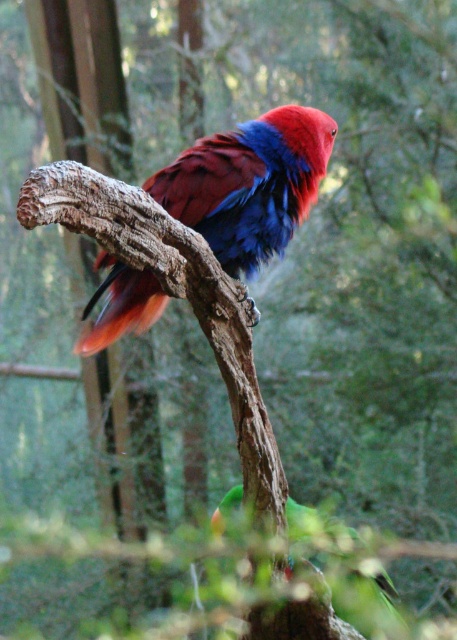
You are a zookeeper who needs to feed two parrots in their enclosure. The shiny multicolored parrot at center and the green matte parrot at lower center are both waiting for food. If the feeding tray is placed exactly halfway between them, how far in centimeters will each parrot have to walk to reach the tray?

The distance between the shiny multicolored parrot at center and the green matte parrot at lower center is 64.80 centimeters. Placing the feeding tray halfway would mean each parrot has to walk 32.40 centimeters to reach it.

You are a zookeeper who needs to place a feeding tray between the shiny multicolored parrot at center and the green matte parrot at lower center. Given their heights, which parrot should the tray be placed closer to ensure it can reach the food?

The shiny multicolored parrot at center is much taller than the green matte parrot at lower center, so the feeding tray should be placed closer to the green matte parrot at lower center to ensure it can reach the food.

From the picture: You are a zookeeper who needs to prepare food for both the shiny multicolored parrot at center and the green matte parrot at lower center. Considering their sizes, which parrot requires a larger portion of food?

The shiny multicolored parrot at center requires a larger portion of food because it has a larger size compared to the green matte parrot at lower center.